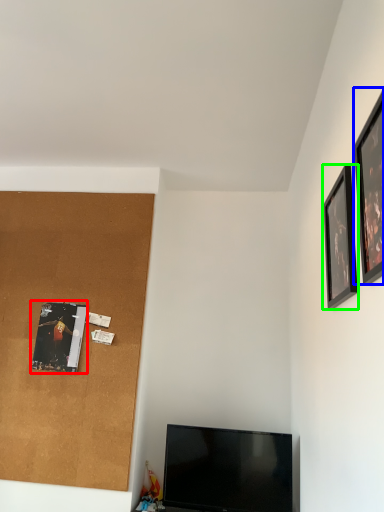
Question: Which object is the closest to the picture frame (highlighted by a red box)? Choose among these: picture frame (highlighted by a blue box) or picture frame (highlighted by a green box).

Choices:
 (A) picture frame
 (B) picture frame

Answer: (B)